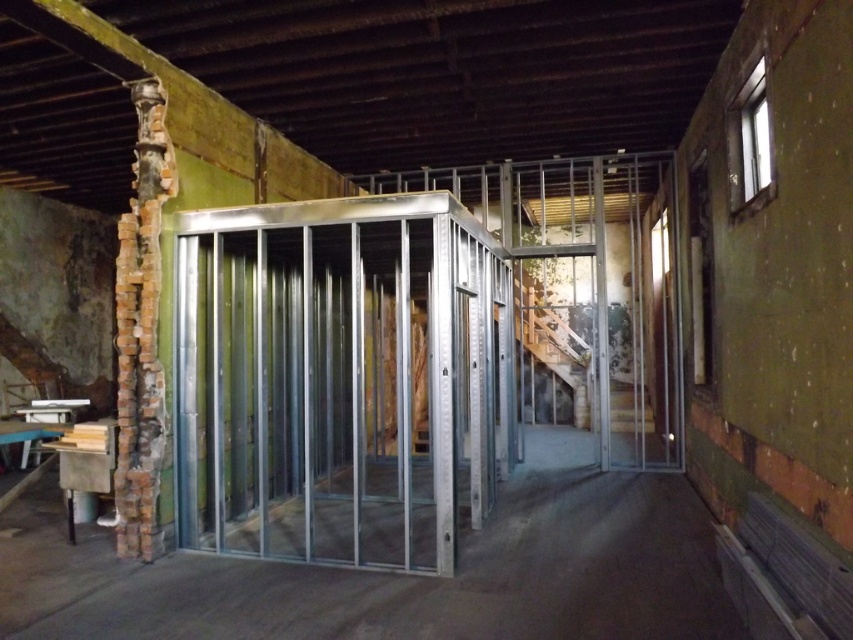
Based on the photo, you are standing in the construction area and need to locate the silver metallic elevator at center. According to the coordinates provided, where should you look to find it?

The silver metallic elevator at center is located at coordinates point (341, 378).

You are an architect inspecting the construction site. You see the silver metallic elevator at center and the metal frame at center. Which one is positioned to the left?

The silver metallic elevator at center is positioned to the left of the metal frame at center.